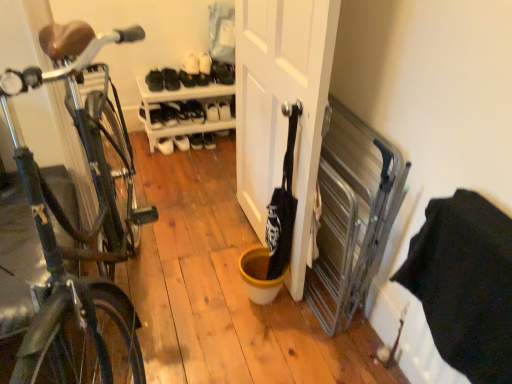
Question: Is white leather shoe at center, positioned as the first shoe in left-to-right order, to the left of white matte door at center from the viewer's perspective?

Choices:
 (A) no
 (B) yes

Answer: (B)

Question: Is white leather shoe at center, which appears as the 7th shoe when viewed from the right, directly adjacent to white matte door at center?

Choices:
 (A) no
 (B) yes

Answer: (A)

Question: From a real-world perspective, is white leather shoe at center, which appears as the 7th shoe when viewed from the right, beneath white matte door at center?

Choices:
 (A) no
 (B) yes

Answer: (B)

Question: From the image's perspective, is white leather shoe at center, positioned as the first shoe in left-to-right order, located beneath white matte door at center?

Choices:
 (A) yes
 (B) no

Answer: (B)

Question: Considering the relative sizes of white leather shoe at center, positioned as the first shoe in left-to-right order, and white matte door at center in the image provided, is white leather shoe at center, positioned as the first shoe in left-to-right order, thinner than white matte door at center?

Choices:
 (A) no
 (B) yes

Answer: (A)

Question: Based on their sizes in the image, would you say black leather shoe at upper center, the 2th shoe when ordered from left to right, is bigger or smaller than shiny black bicycle at left?

Choices:
 (A) big
 (B) small

Answer: (B)

Question: Do you think black leather shoe at upper center, positioned as the 6th shoe in right-to-left order, is within shiny black bicycle at left, or outside of it?

Choices:
 (A) outside
 (B) inside

Answer: (A)

Question: Considering their positions, is black leather shoe at upper center, positioned as the 6th shoe in right-to-left order, located in front of or behind shiny black bicycle at left?

Choices:
 (A) front
 (B) behind

Answer: (B)

Question: From a real-world perspective, is black leather shoe at upper center, the 2th shoe when ordered from left to right, positioned above or below shiny black bicycle at left?

Choices:
 (A) above
 (B) below

Answer: (B)

Question: In terms of size, does white matte shoe at upper center, the fourth shoe from the left, appear bigger or smaller than yellow matte bucket at center?

Choices:
 (A) small
 (B) big

Answer: (A)

Question: Is point (200, 120) closer or farther from the camera than point (250, 278)?

Choices:
 (A) farther
 (B) closer

Answer: (A)

Question: Is white matte shoe at upper center, the 4th shoe positioned from the right, wider or thinner than yellow matte bucket at center?

Choices:
 (A) thin
 (B) wide

Answer: (B)

Question: Is white matte shoe at upper center, the 4th shoe positioned from the right, inside the boundaries of yellow matte bucket at center, or outside?

Choices:
 (A) inside
 (B) outside

Answer: (B)

Question: Considering the positions of white matte shoe at upper center, the fourth shoe from the left, and white matte shoe at upper center, marked as the seventh shoe in a left-to-right arrangement, in the image, is white matte shoe at upper center, the fourth shoe from the left, taller or shorter than white matte shoe at upper center, marked as the seventh shoe in a left-to-right arrangement,?

Choices:
 (A) short
 (B) tall

Answer: (B)

Question: From a real-world perspective, is white matte shoe at upper center, the 4th shoe positioned from the right, positioned above or below white matte shoe at upper center, marked as the seventh shoe in a left-to-right arrangement?

Choices:
 (A) below
 (B) above

Answer: (A)